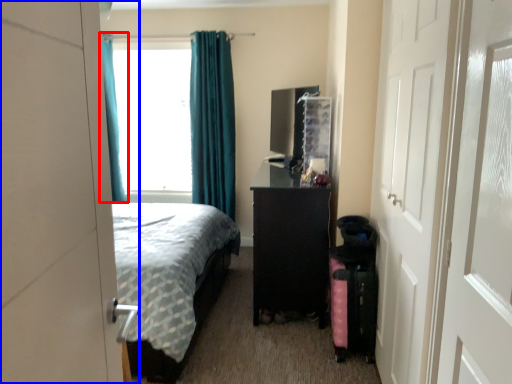
Question: Which of the following is the farthest to the observer, curtain (highlighted by a red box) or door (highlighted by a blue box)?

Choices:
 (A) curtain
 (B) door

Answer: (A)